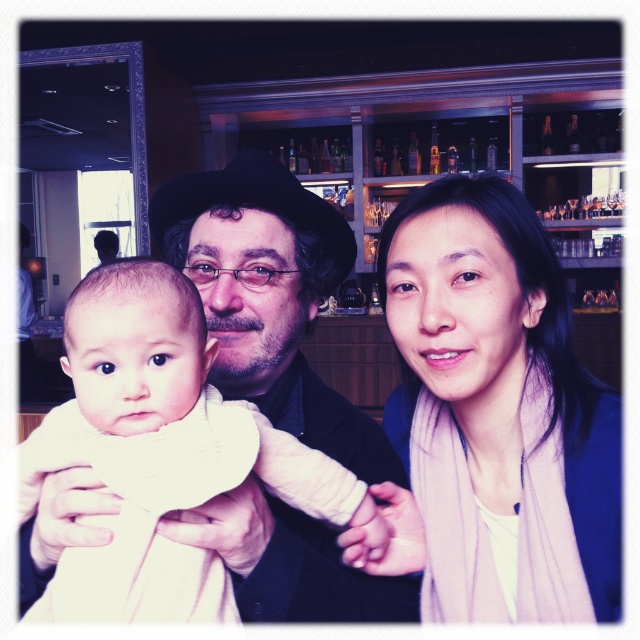
Which is below, pink scarf at center or white soft cloth at center?

Positioned lower is white soft cloth at center.

Where is `pink scarf at center`? This screenshot has width=640, height=640. pink scarf at center is located at coordinates (497, 410).